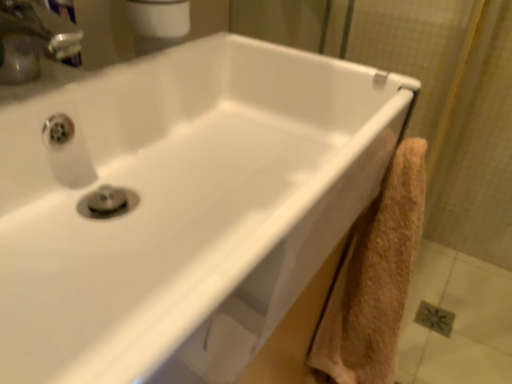
Describe the element at coordinates (32, 39) in the screenshot. This screenshot has width=512, height=384. I see `brushed metal faucet at upper left` at that location.

At what (x,y) coordinates should I click in order to perform the action: click on brushed metal faucet at upper left. Please return your answer as a coordinate pair (x, y). Looking at the image, I should click on (32, 39).

This screenshot has height=384, width=512. Find the location of `brushed metal faucet at upper left`. brushed metal faucet at upper left is located at coordinates (32, 39).